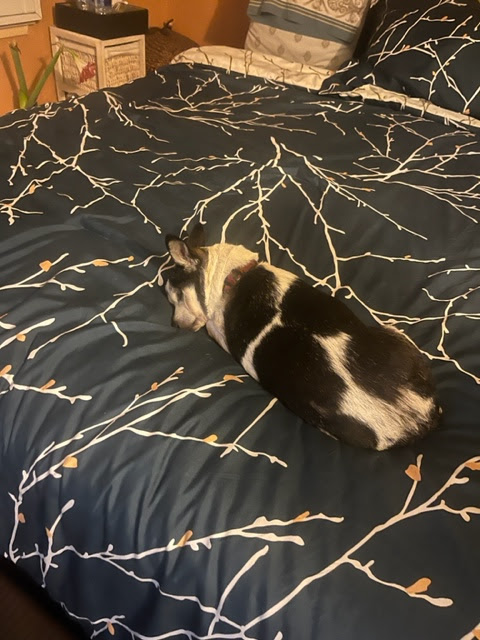
The height and width of the screenshot is (640, 480). I want to click on bedspread, so click(217, 152).